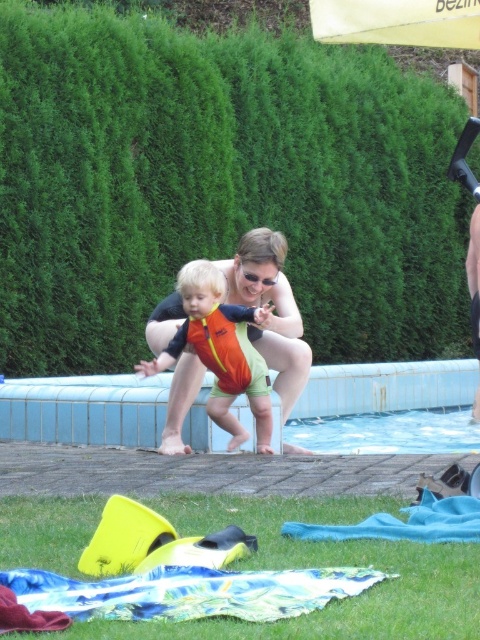
Question: Considering the real-world distances, which object is closest to the orange fabric swimsuit at center?

Choices:
 (A) green leafy hedge at upper center
 (B) printed fabric blanket at lower center
 (C) blue tile swimming pool at center

Answer: (C)

Question: Is green leafy hedge at upper center wider than orange fabric swimsuit at center?

Choices:
 (A) yes
 (B) no

Answer: (A)

Question: Among these points, which one is nearest to the camera?

Choices:
 (A) (415, 385)
 (B) (431, 275)

Answer: (A)

Question: Observing the image, what is the correct spatial positioning of green leafy hedge at upper center in reference to printed fabric blanket at lower center?

Choices:
 (A) above
 (B) below

Answer: (A)

Question: Is blue tile swimming pool at center below printed fabric blanket at lower center?

Choices:
 (A) yes
 (B) no

Answer: (B)

Question: Which is nearer to the orange fabric swimsuit at center?

Choices:
 (A) green leafy hedge at upper center
 (B) printed fabric blanket at lower center

Answer: (B)